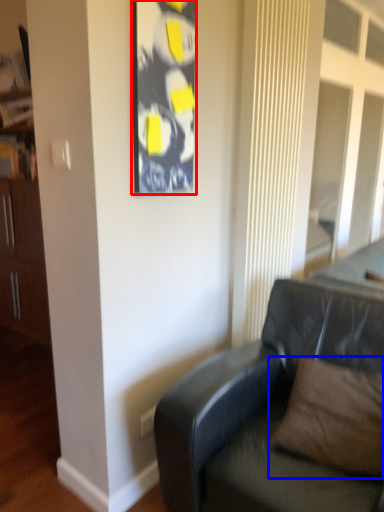
Question: Which of the following is the closest to the observer, picture frame (highlighted by a red box) or pillow (highlighted by a blue box)?

Choices:
 (A) picture frame
 (B) pillow

Answer: (B)